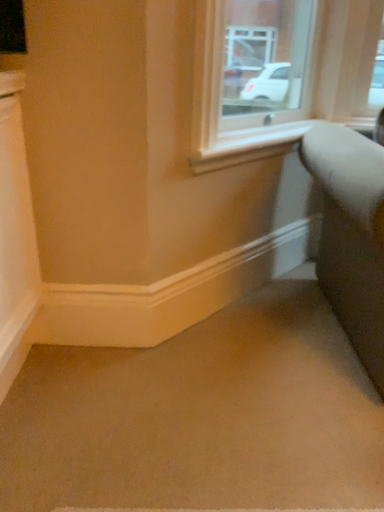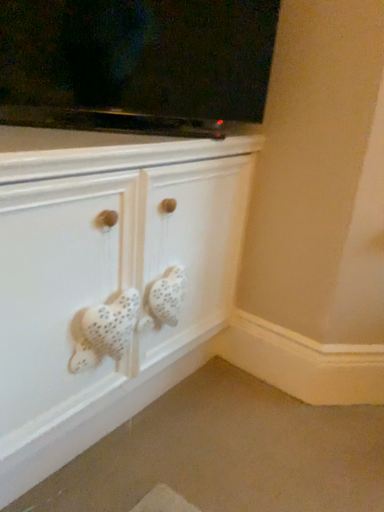
Question: How did the camera likely rotate when shooting the video?

Choices:
 (A) rotated upward
 (B) rotated downward

Answer: (A)